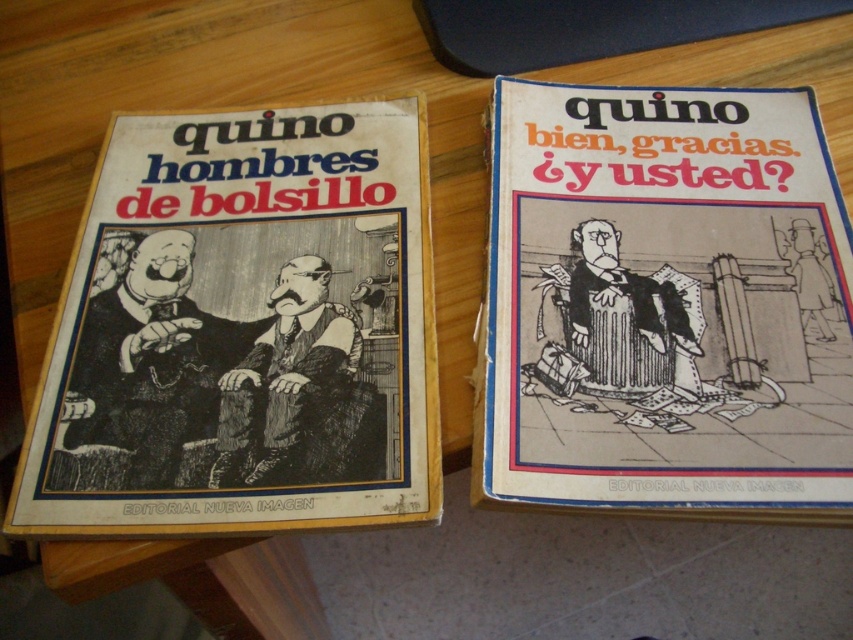
You are organizing a bookshelf and need to place the black paper book at left and the black line art man at center. Which object has a greater width?

The black paper book at left has a greater width than the black line art man at center.

You are organizing a bookshelf and need to place the black paper book at center and the black ink drawing of man at center. According to the image, which object is positioned to the right of the other?

The black paper book at center is to the right of the black ink drawing of man at center.